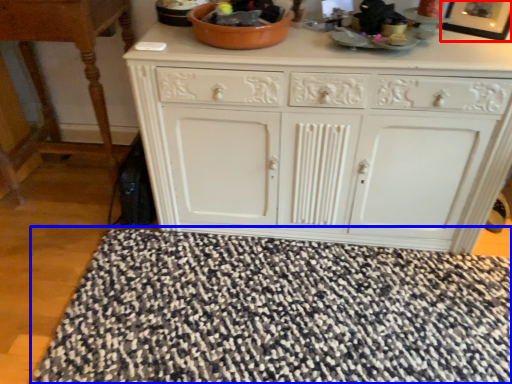
Question: Which object is closer to the camera taking this photo, picture frame (highlighted by a red box) or doormat (highlighted by a blue box)?

Choices:
 (A) picture frame
 (B) doormat

Answer: (B)